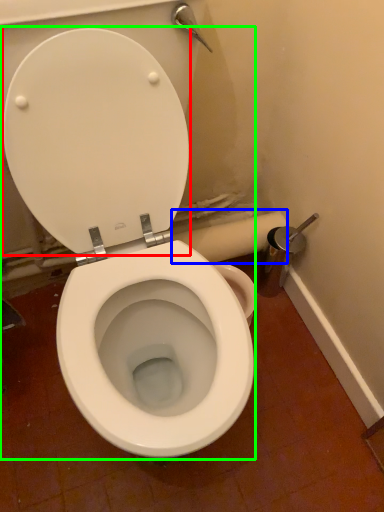
Question: Which object is the farthest from back (highlighted by a red box)? Choose among these: toilet paper (highlighted by a blue box) or toilet (highlighted by a green box).

Choices:
 (A) toilet paper
 (B) toilet

Answer: (A)